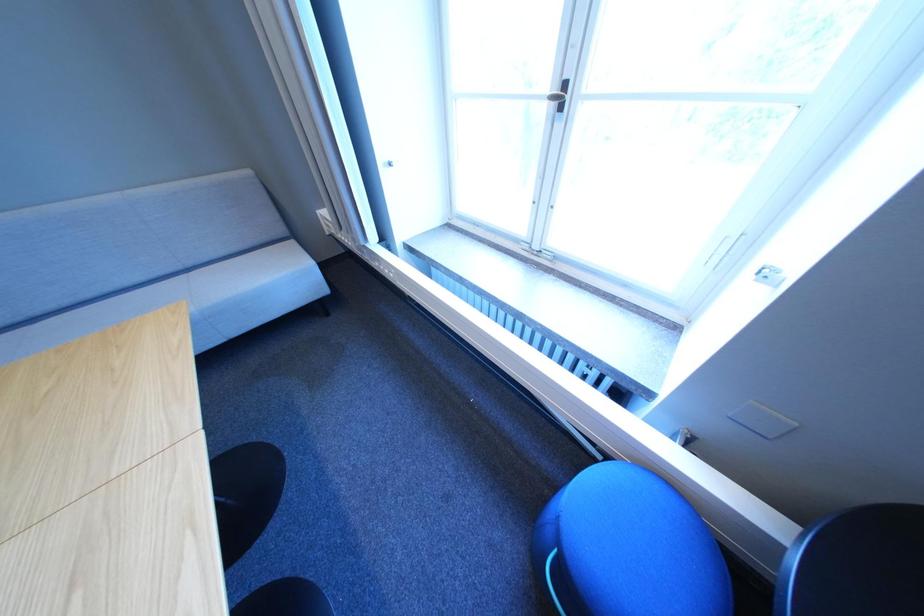
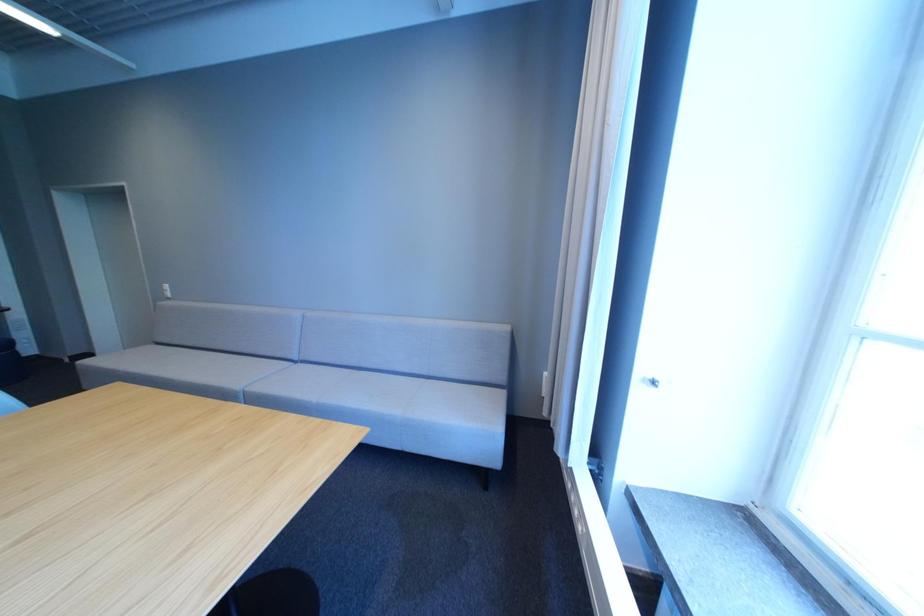
Question: The first image is from the beginning of the video and the second image is from the end. How did the camera likely rotate when shooting the video?

Choices:
 (A) Left
 (B) Right
 (C) Up
 (D) Down

Answer: (A)